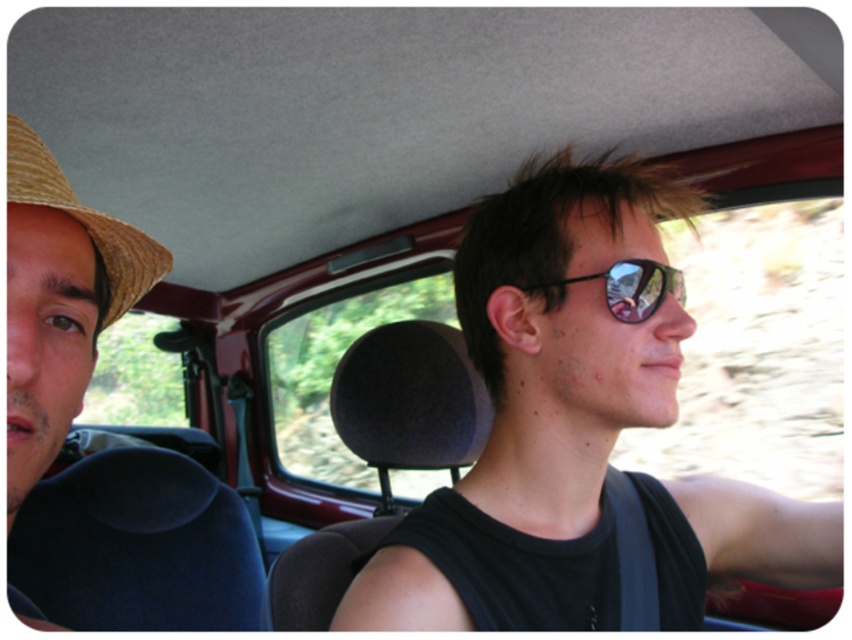
Identify the location of sunglasses at center. (x=538, y=410).

Between point (666, 385) and point (26, 124), which one is positioned behind?

The point (666, 385) is behind.

Image resolution: width=852 pixels, height=640 pixels. Find the location of `sunglasses at center`. sunglasses at center is located at coordinates (538, 410).

Does sunglasses at center come in front of straw hat at left?

No, sunglasses at center is behind straw hat at left.

Measure the distance between point (659, 204) and camera.

Point (659, 204) is 27.73 inches away from camera.

You are a GUI agent. You are given a task and a screenshot of the screen. Output one action in this format:
    pyautogui.click(x=<x>, y=<y>)
    Task: Click on the sunglasses at center
    Image resolution: width=852 pixels, height=640 pixels.
    Given the screenshot: What is the action you would take?
    pyautogui.click(x=538, y=410)

Consider the image. Who is positioned more to the left, sunglasses at center or black reflective sunglasses at center?

sunglasses at center

Where is `sunglasses at center`? sunglasses at center is located at coordinates (538, 410).